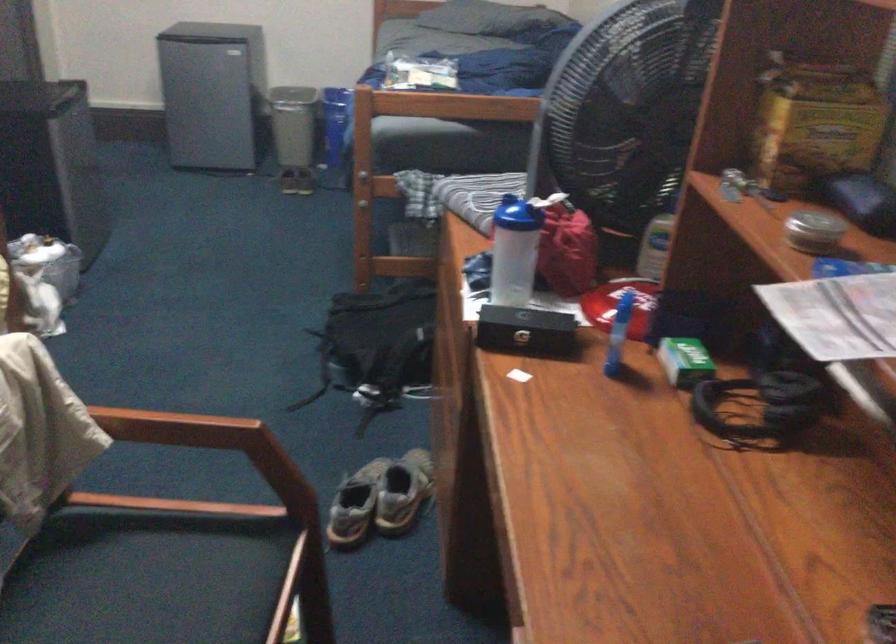
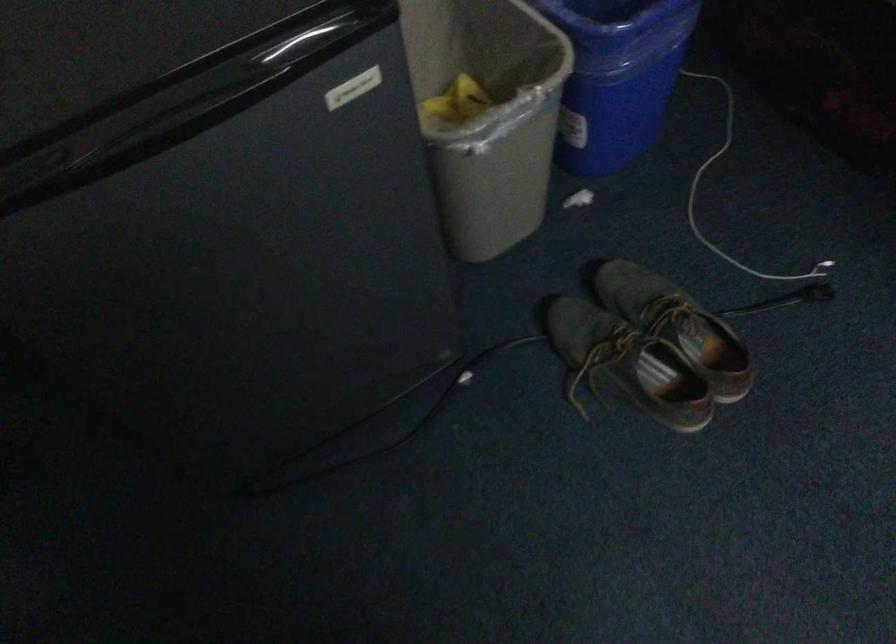
Where in the second image is the point corresponding to [263,69] from the first image?

(487, 115)